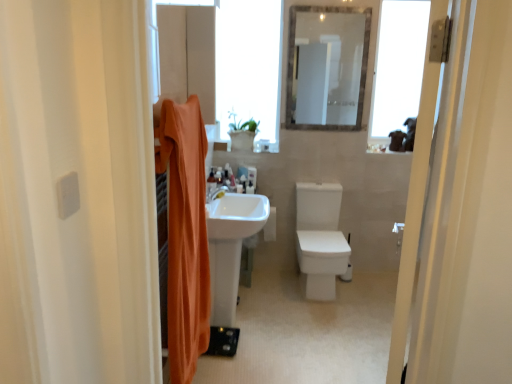
Question: Based on their sizes in the image, would you say orange fabric shower curtain at left is bigger or smaller than clear glass mirror at upper center?

Choices:
 (A) small
 (B) big

Answer: (B)

Question: Is orange fabric shower curtain at left wider or thinner than clear glass mirror at upper center?

Choices:
 (A) wide
 (B) thin

Answer: (A)

Question: Considering the real-world distances, which object is closest to the orange fabric shower curtain at left?

Choices:
 (A) transparent glass window at upper center, acting as the second window starting from the right
 (B) white glossy sink at center
 (C) white glossy tap at center
 (D) translucent plastic bottle at center, arranged as the 1th toiletry when viewed from the back
 (E) matte plastic toothbrush at center, which appears as the first toiletry when viewed from the right

Answer: (B)

Question: Which of these objects is positioned farthest from the orange fabric shower curtain at left?

Choices:
 (A) translucent plastic bottle at center, the 3th toiletry when ordered from right to left
 (B) clear glass mirror at upper center
 (C) white matte toilet paper at center
 (D) transparent glass window at upper right, arranged as the second window when viewed from the left
 (E) white glossy sink at center

Answer: (D)